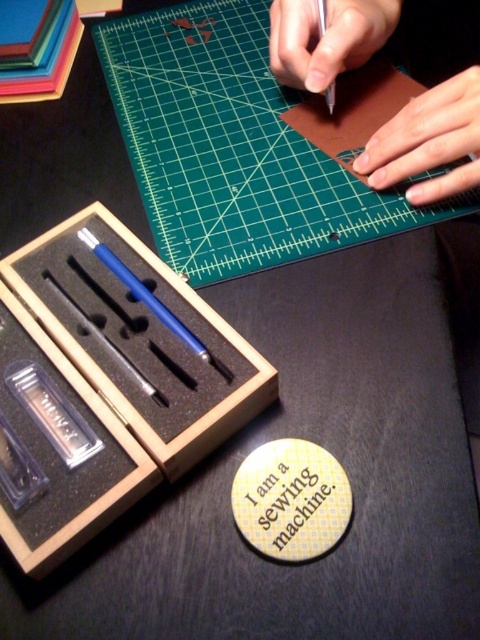
In the scene shown: Looking at the workspace setup, you notice two areas with smooth skin. The first is labeled as smooth skin at upper right and the second as smooth skin hand at upper center. Which of these two areas has a greater height in the image?

The smooth skin at upper right is much taller as smooth skin hand at upper center.

You are a craftsperson who needs to reach the wooden box at lower left to grab a tool. If your arm can extend 12 inches, can you comfortably reach it?

The wooden box at lower left is 14.43 inches away from the viewer. Since your arm can only extend 12 inches, you cannot comfortably reach it without moving closer.